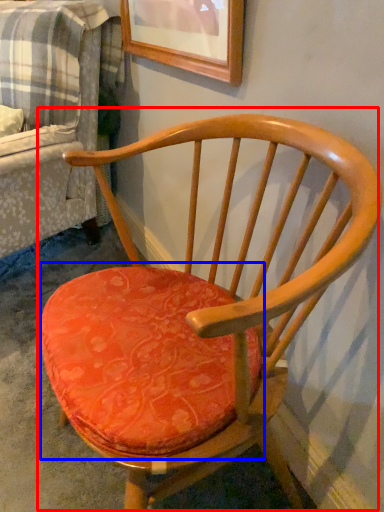
Question: Which of the following is the farthest to the observer, chair (highlighted by a red box) or table (highlighted by a blue box)?

Choices:
 (A) chair
 (B) table

Answer: (B)